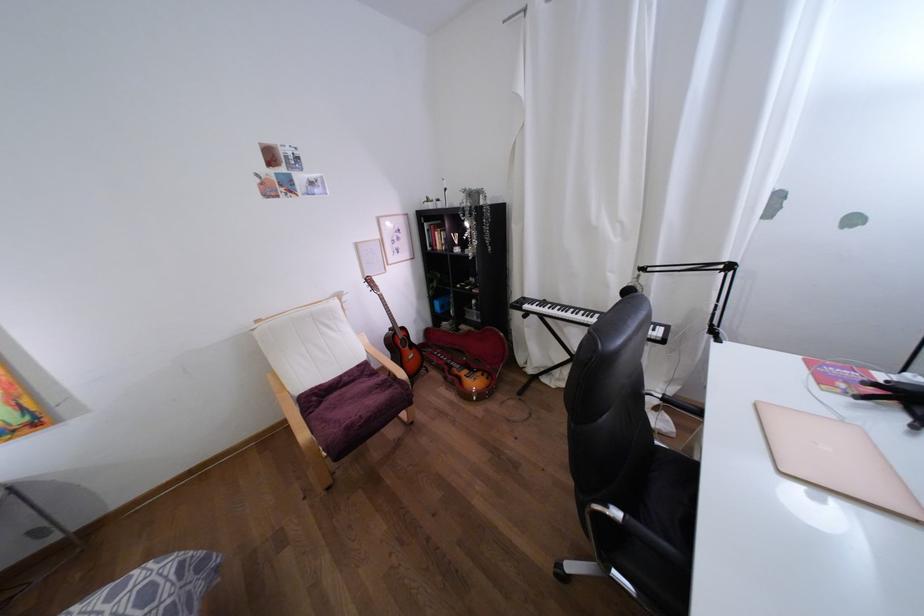
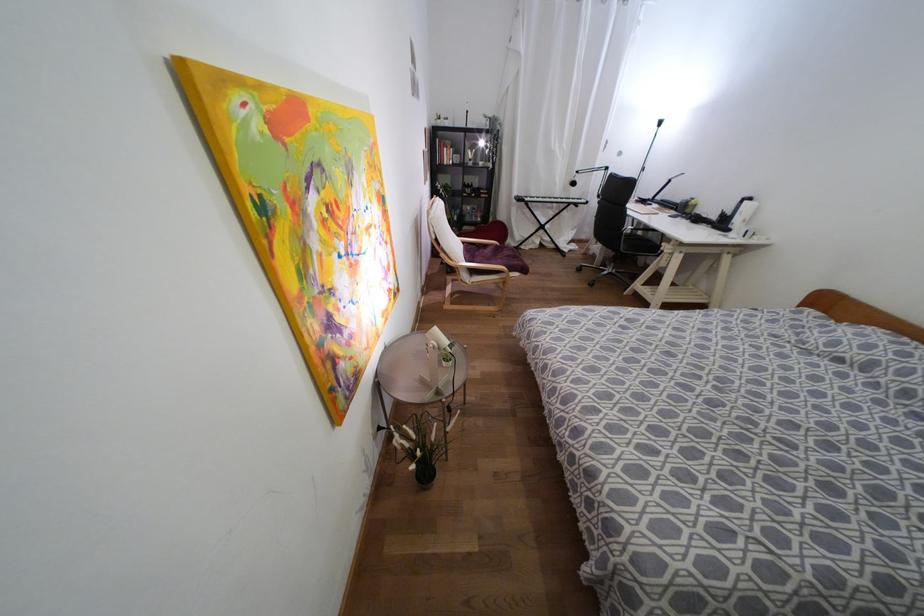
Where in the second image is the point corresponding to (467,224) from the first image?

(480, 143)